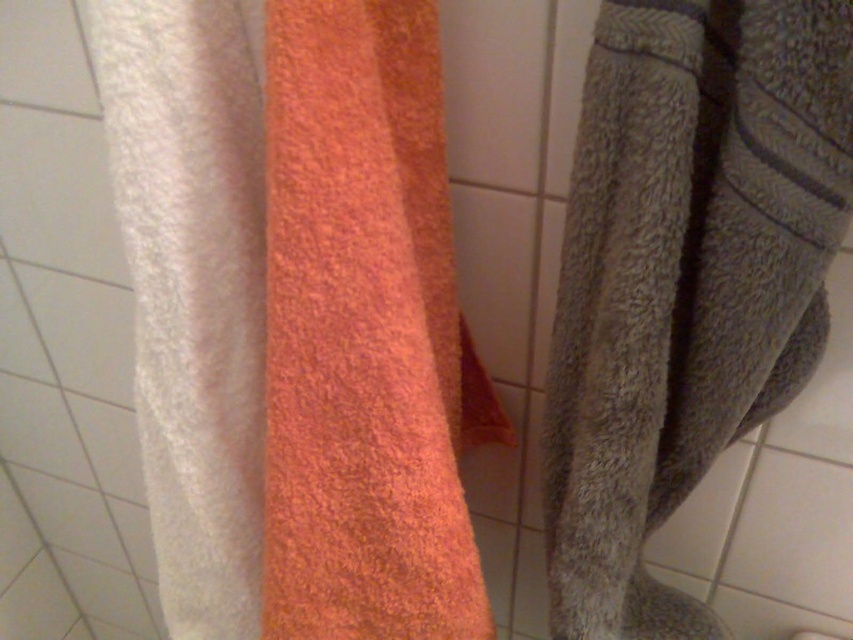
Question: Can you confirm if white fluffy towel at left is wider than gray textured towel at right?

Choices:
 (A) no
 (B) yes

Answer: (B)

Question: Among these objects, which one is nearest to the camera?

Choices:
 (A) white fluffy towel at left
 (B) gray textured towel at right

Answer: (B)

Question: Among these objects, which one is farthest from the camera?

Choices:
 (A) white fluffy towel at left
 (B) gray textured towel at right

Answer: (A)

Question: Can you confirm if white fluffy towel at left is positioned above gray textured towel at right?

Choices:
 (A) no
 (B) yes

Answer: (B)

Question: Which object is closer to the camera taking this photo?

Choices:
 (A) white fluffy towel at left
 (B) gray textured towel at right

Answer: (B)

Question: Does white fluffy towel at left have a lesser width compared to gray textured towel at right?

Choices:
 (A) no
 (B) yes

Answer: (A)